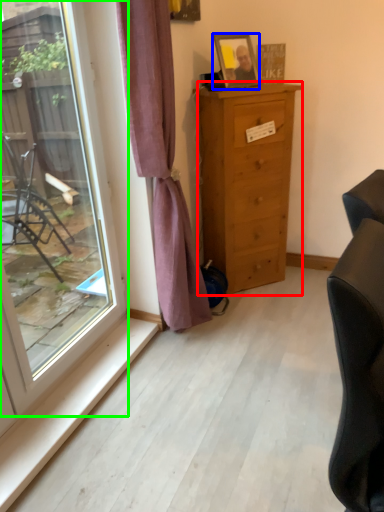
Question: Estimate the real-world distances between objects in this image. Which object is closer to chest of drawers (highlighted by a red box), picture frame (highlighted by a blue box) or window (highlighted by a green box)?

Choices:
 (A) picture frame
 (B) window

Answer: (A)